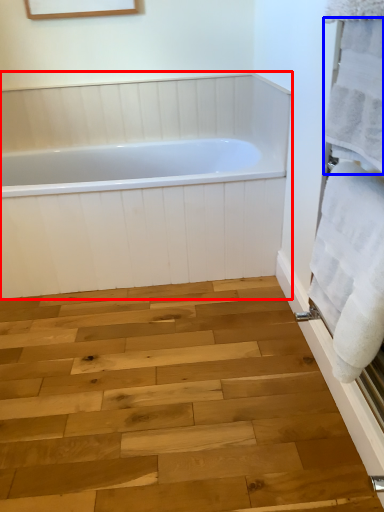
Question: Which of the following is the farthest to the observer, bathtub (highlighted by a red box) or bath towel (highlighted by a blue box)?

Choices:
 (A) bathtub
 (B) bath towel

Answer: (A)